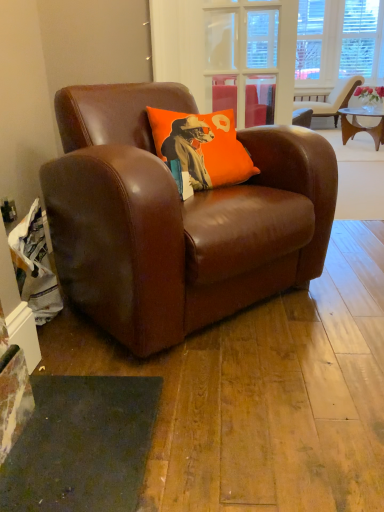
Question: Does beige leather chair at upper right, the second chair from the front, come behind orange fabric pillow at center?

Choices:
 (A) no
 (B) yes

Answer: (B)

Question: Is beige leather chair at upper right, which is the 2th chair in bottom-to-top order, in contact with orange fabric pillow at center?

Choices:
 (A) yes
 (B) no

Answer: (B)

Question: Can you confirm if beige leather chair at upper right, the second chair from the front, is thinner than orange fabric pillow at center?

Choices:
 (A) no
 (B) yes

Answer: (A)

Question: Is beige leather chair at upper right, arranged as the 1th chair when viewed from the right, smaller than orange fabric pillow at center?

Choices:
 (A) yes
 (B) no

Answer: (B)

Question: Does beige leather chair at upper right, which is the 1th chair in top-to-bottom order, have a larger size compared to orange fabric pillow at center?

Choices:
 (A) no
 (B) yes

Answer: (B)

Question: Is beige leather chair at upper right, the second chair from the front, closer to camera compared to orange fabric pillow at center?

Choices:
 (A) no
 (B) yes

Answer: (A)

Question: Is transparent glass door at upper center aimed at brown leather chair at center, positioned as the 1th chair in front-to-back order?

Choices:
 (A) no
 (B) yes

Answer: (B)

Question: Can you confirm if transparent glass door at upper center is thinner than brown leather chair at center, positioned as the second chair in back-to-front order?

Choices:
 (A) yes
 (B) no

Answer: (A)

Question: Is transparent glass door at upper center wider than brown leather chair at center, positioned as the 1th chair in front-to-back order?

Choices:
 (A) no
 (B) yes

Answer: (A)

Question: Is transparent glass door at upper center looking in the opposite direction of brown leather chair at center, positioned as the second chair in top-to-bottom order?

Choices:
 (A) yes
 (B) no

Answer: (B)

Question: Is transparent glass door at upper center not near brown leather chair at center, which is counted as the 1th chair, starting from the bottom?

Choices:
 (A) no
 (B) yes

Answer: (B)

Question: Is transparent glass door at upper center not within brown leather chair at center, positioned as the second chair in back-to-front order?

Choices:
 (A) yes
 (B) no

Answer: (A)

Question: Is orange fabric pillow at center thinner than brown leather chair at center, which appears as the second chair when viewed from the right?

Choices:
 (A) yes
 (B) no

Answer: (A)